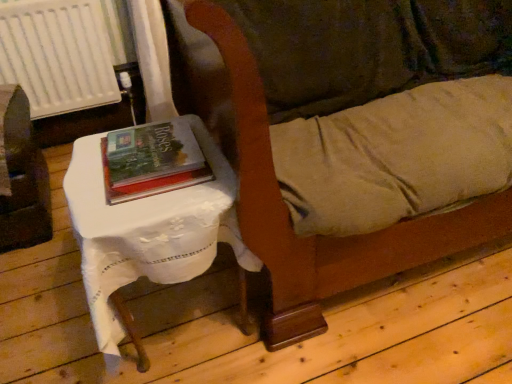
Identify the location of free space below white cloth-covered table at left (from a real-world perspective). (168, 326).